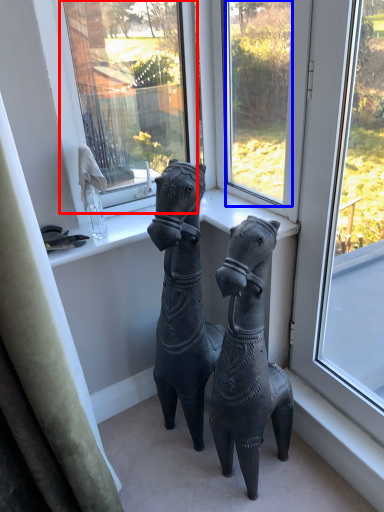
Question: Which point is closer to the camera, window screen (highlighted by a red box) or window (highlighted by a blue box)?

Choices:
 (A) window screen
 (B) window

Answer: (B)